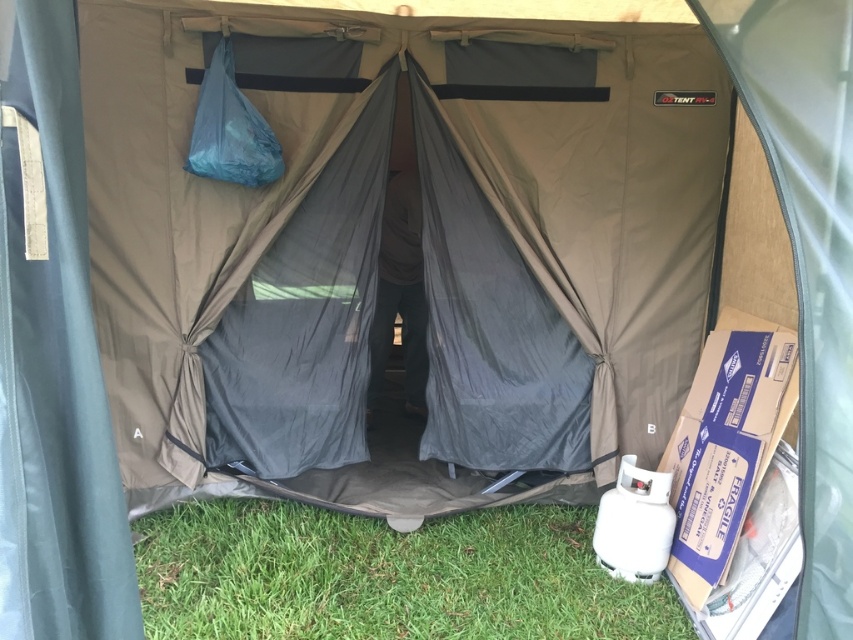
Question: Can you confirm if green grass at lower left is bigger than blue fabric sleeping bag at upper center?

Choices:
 (A) yes
 (B) no

Answer: (A)

Question: Does green grass at lower left appear on the right side of blue fabric sleeping bag at upper center?

Choices:
 (A) no
 (B) yes

Answer: (B)

Question: Can you confirm if green grass at lower left is thinner than blue fabric sleeping bag at upper center?

Choices:
 (A) yes
 (B) no

Answer: (B)

Question: Which object appears farthest from the camera in this image?

Choices:
 (A) green grass at lower left
 (B) blue fabric sleeping bag at upper center

Answer: (B)